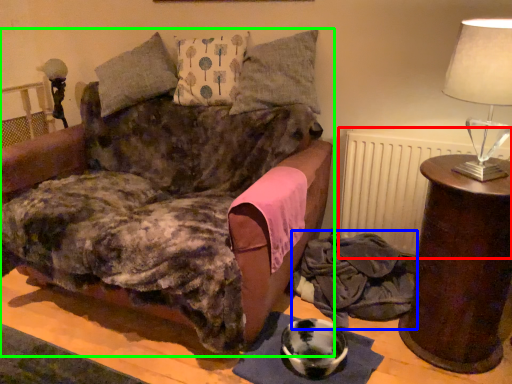
Question: Estimate the real-world distances between objects in this image. Which object is farther from radiator (highlighted by a red box), material (highlighted by a blue box) or furniture (highlighted by a green box)?

Choices:
 (A) material
 (B) furniture

Answer: (B)